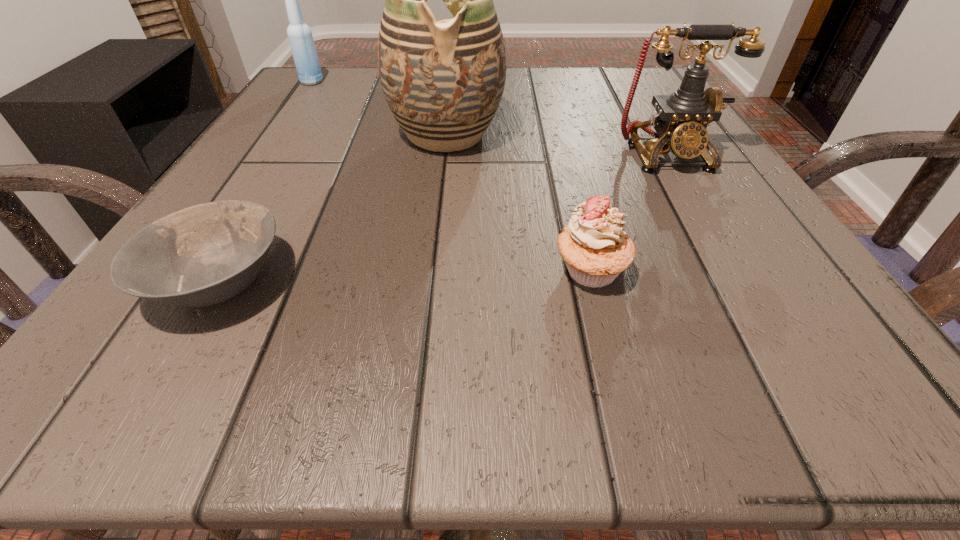
Where is `vacant space at the near edge of the desktop`? This screenshot has height=540, width=960. vacant space at the near edge of the desktop is located at coordinates (463, 403).

Locate an element on the screen. vacant area at the left edge is located at coordinates (269, 205).

You are a GUI agent. You are given a task and a screenshot of the screen. Output one action in this format:
    pyautogui.click(x=<x>, y=<y>)
    Task: Click on the free space at the right edge of the desktop
    Image resolution: width=960 pixels, height=540 pixels.
    Given the screenshot: What is the action you would take?
    pyautogui.click(x=733, y=297)

This screenshot has height=540, width=960. In the image, there is a desktop. In order to click on free space at the far right corner in this screenshot , I will do `click(638, 85)`.

This screenshot has width=960, height=540. In the image, there is a desktop. Find the location of `vacant space at the near right corner`. vacant space at the near right corner is located at coordinates (872, 404).

The height and width of the screenshot is (540, 960). What are the coordinates of `free space between the pottery and the shortest object` in the screenshot? It's located at (333, 207).

Where is `free space that is in between the third object from right to left and the cupcake`? The height and width of the screenshot is (540, 960). free space that is in between the third object from right to left and the cupcake is located at coordinates (x=518, y=202).

Find the location of a particular element. free point between the telephone and the cupcake is located at coordinates (628, 213).

The width and height of the screenshot is (960, 540). In order to click on free space that is in between the cupcake and the pottery in this screenshot , I will do `click(518, 202)`.

Identify the location of vacant area that lies between the shortest object and the farthest object. This screenshot has width=960, height=540. (266, 181).